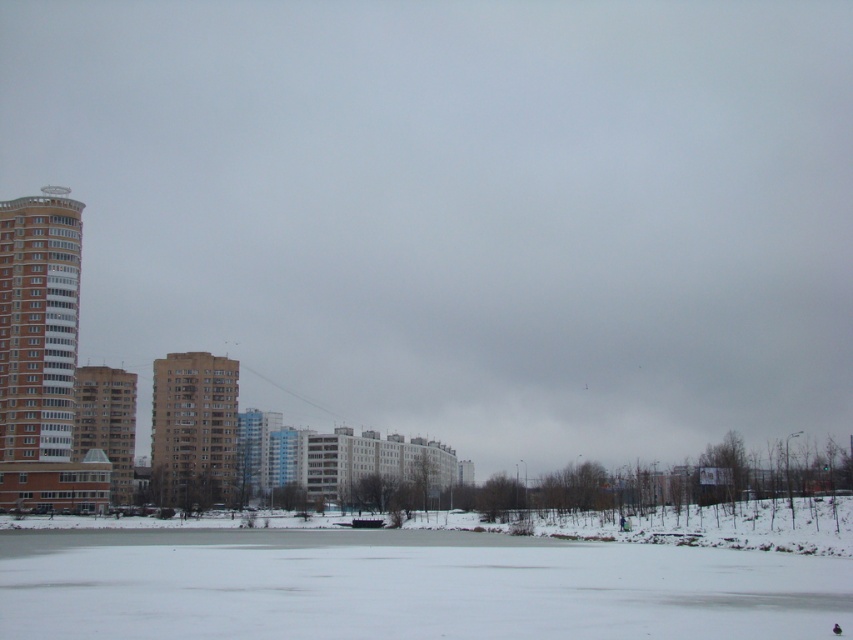
Which is below, brown glossy building at left or brown brick building at center?

brown brick building at center is lower down.

Does point (0, 285) lie in front of point (229, 420)?

Yes, it is.

Who is more distant from viewer, (6, 490) or (212, 486)?

The point (212, 486) is more distant.

Where is `brown glossy building at left`? brown glossy building at left is located at coordinates (41, 356).

Can you confirm if brown glossy building at left is shorter than brown brick building at left?

No, brown glossy building at left is not shorter than brown brick building at left.

Image resolution: width=853 pixels, height=640 pixels. What do you see at coordinates (41, 356) in the screenshot? I see `brown glossy building at left` at bounding box center [41, 356].

Is point (70, 268) positioned before point (126, 372)?

Yes, point (70, 268) is closer to viewer.

Find the location of a particular element. The width and height of the screenshot is (853, 640). brown glossy building at left is located at coordinates (41, 356).

Is brown brick building at center behind brown brick building at left?

Yes, it is behind brown brick building at left.

You are a GUI agent. You are given a task and a screenshot of the screen. Output one action in this format:
    pyautogui.click(x=<x>, y=<y>)
    Task: Click on the brown brick building at center
    
    Given the screenshot: What is the action you would take?
    pyautogui.click(x=193, y=428)